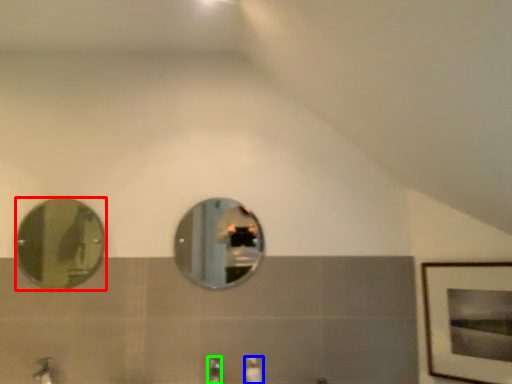
Question: Considering the real-world distances, which object is closest to mirror (highlighted by a red box)? toiletry (highlighted by a blue box) or faucet (highlighted by a green box).

Choices:
 (A) toiletry
 (B) faucet

Answer: (B)